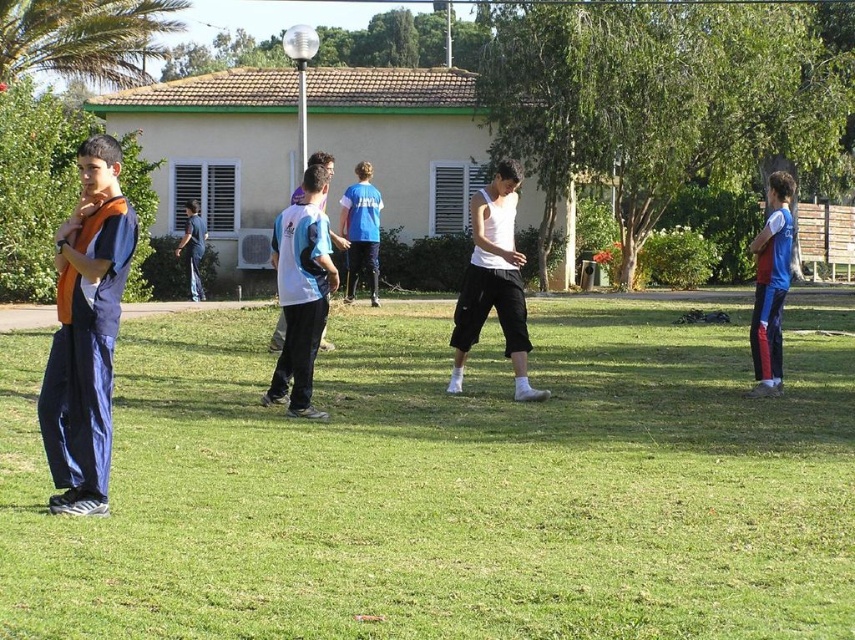
Can you confirm if matte blue tracksuit at left is thinner than white jersey at center?

Indeed, matte blue tracksuit at left has a lesser width compared to white jersey at center.

What do you see at coordinates (86, 332) in the screenshot? I see `matte blue tracksuit at left` at bounding box center [86, 332].

This screenshot has width=855, height=640. I want to click on matte blue tracksuit at left, so click(x=86, y=332).

Between point (68, 353) and point (765, 237), which one is positioned in front?

Point (68, 353) is more forward.

From the picture: Can you confirm if matte blue tracksuit at left is positioned above blue jersey at right?

Incorrect, matte blue tracksuit at left is not positioned above blue jersey at right.

Is point (108, 397) positioned after point (765, 321)?

No, it is not.

What are the coordinates of `matte blue tracksuit at left` in the screenshot? It's located at (86, 332).

Can you confirm if white matte tank top at center is taller than blue jersey at right?

In fact, white matte tank top at center may be shorter than blue jersey at right.

Does point (510, 234) come behind point (764, 296)?

That is False.

Which is in front, point (482, 301) or point (758, 314)?

Point (482, 301) is in front.

The image size is (855, 640). In order to click on white matte tank top at center in this screenshot , I will do `click(494, 282)`.